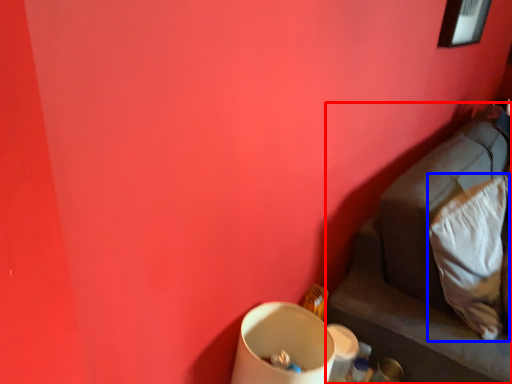
Question: Among these objects, which one is nearest to the camera, furniture (highlighted by a red box) or pillow (highlighted by a blue box)?

Choices:
 (A) furniture
 (B) pillow

Answer: (A)